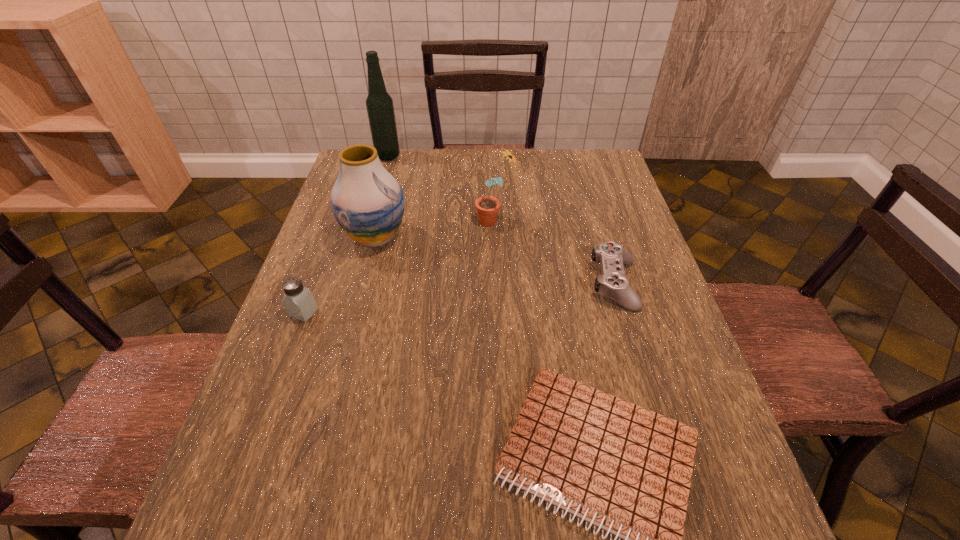
Identify the location of vacant position in the image that satisfies the following two spatial constraints: 1. on the back side of the vase; 2. on the left side of the third shortest object. (331, 237).

Identify the location of vacant region that satisfies the following two spatial constraints: 1. on the flower of the sunflower; 2. on the front side of the third shortest object. The width and height of the screenshot is (960, 540). (498, 313).

Identify the location of vacant space that satisfies the following two spatial constraints: 1. on the flower of the sunflower; 2. on the left side of the second shortest object. The width and height of the screenshot is (960, 540). (497, 284).